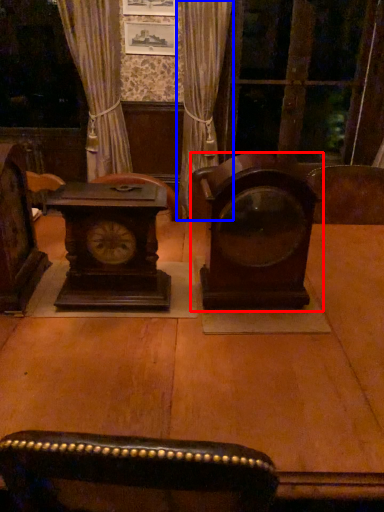
Question: Which object is further to the camera taking this photo, alarm clock (highlighted by a red box) or curtain (highlighted by a blue box)?

Choices:
 (A) alarm clock
 (B) curtain

Answer: (B)